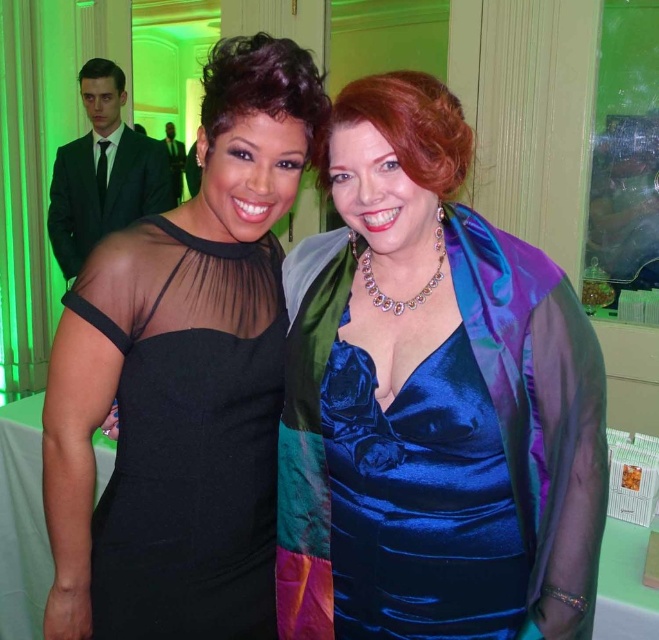
Does point (144, 323) come in front of point (459, 474)?

No, (144, 323) is behind (459, 474).

Who is positioned more to the left, black sheer dress at center or shiny blue dress at center?

Positioned to the left is black sheer dress at center.

At what (x,y) coordinates should I click in order to perform the action: click on black sheer dress at center. Please return your answer as a coordinate pair (x, y). Image resolution: width=659 pixels, height=640 pixels. Looking at the image, I should click on (183, 378).

The width and height of the screenshot is (659, 640). I want to click on black sheer dress at center, so click(x=183, y=378).

Identify the location of satin blue dress at center. The image size is (659, 640). (432, 401).

Which of these two, satin blue dress at center or black sheer dress at center, stands taller?

black sheer dress at center

What do you see at coordinates (432, 401) in the screenshot? I see `satin blue dress at center` at bounding box center [432, 401].

At what (x,y) coordinates should I click in order to perform the action: click on satin blue dress at center. Please return your answer as a coordinate pair (x, y). The image size is (659, 640). Looking at the image, I should click on (432, 401).

Can you confirm if satin blue dress at center is smaller than shiny blue dress at center?

Actually, satin blue dress at center might be larger than shiny blue dress at center.

Does point (581, 602) come closer to viewer compared to point (467, 456)?

That is False.

The height and width of the screenshot is (640, 659). I want to click on satin blue dress at center, so [432, 401].